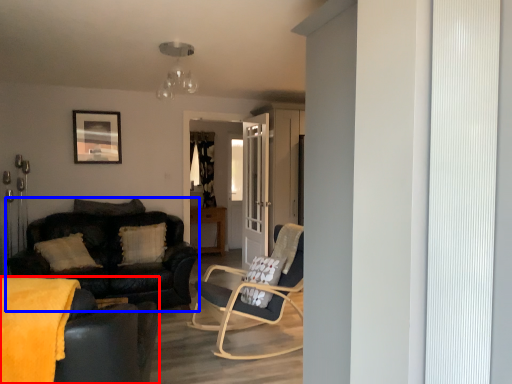
Question: Which of the following is the closest to the observer, studio couch (highlighted by a red box) or studio couch (highlighted by a blue box)?

Choices:
 (A) studio couch
 (B) studio couch

Answer: (A)